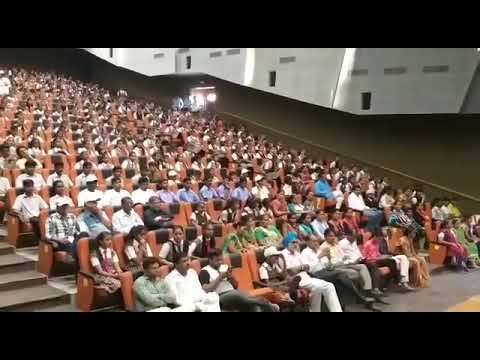
The height and width of the screenshot is (360, 480). Identify the location of white wall. (325, 63).